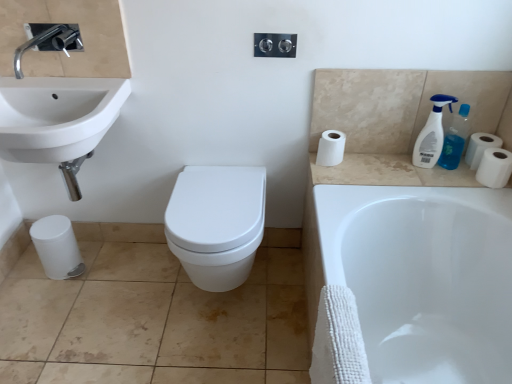
Where is `vacant point above white matte toilet paper at lower left, positioned as the 4th toilet paper in right-to-left order (from a real-world perspective)`? vacant point above white matte toilet paper at lower left, positioned as the 4th toilet paper in right-to-left order (from a real-world perspective) is located at coordinates (51, 223).